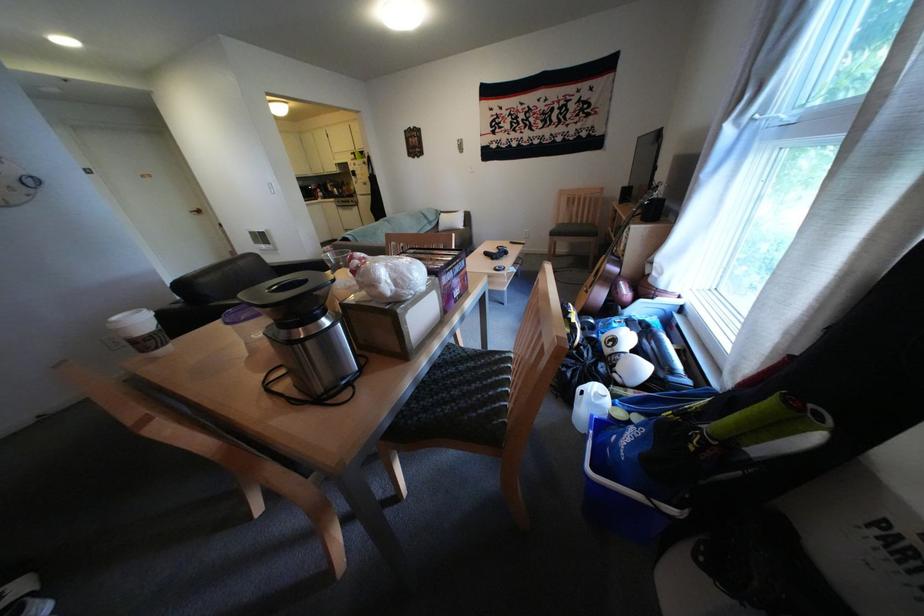
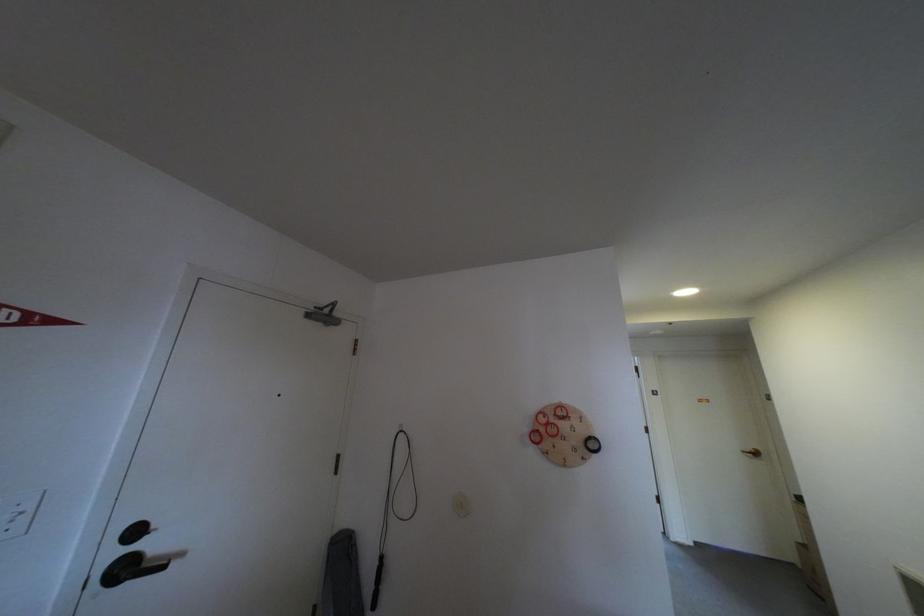
In the second image, find the point that corresponds to (x=33, y=185) in the first image.

(597, 446)